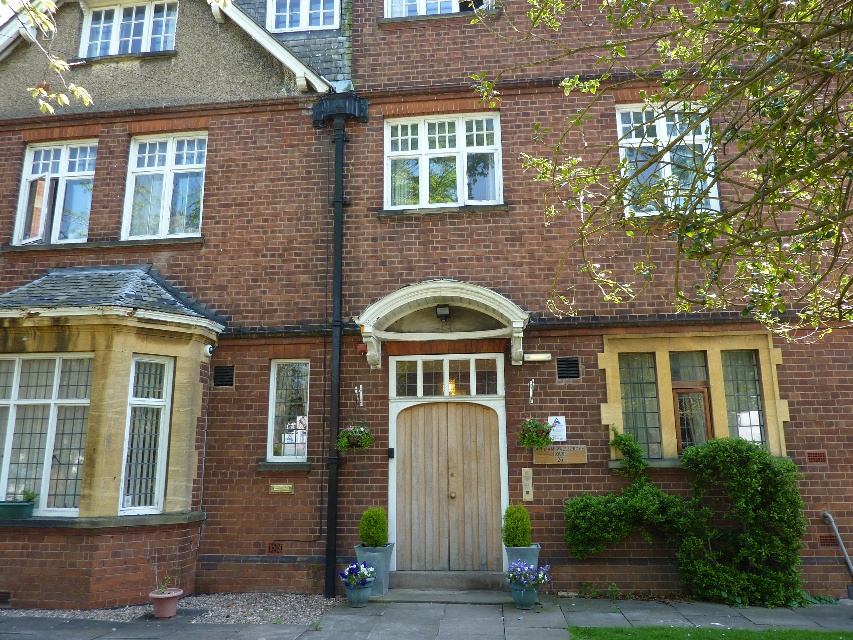
Does point (444, 499) come in front of point (328, 115)?

That is True.

Does point (431, 488) come farther from viewer compared to point (332, 470)?

Yes.

Is point (457, 436) farther from viewer compared to point (337, 236)?

No, it is not.

What are the coordinates of `natural wood door at center` in the screenshot? It's located at (447, 486).